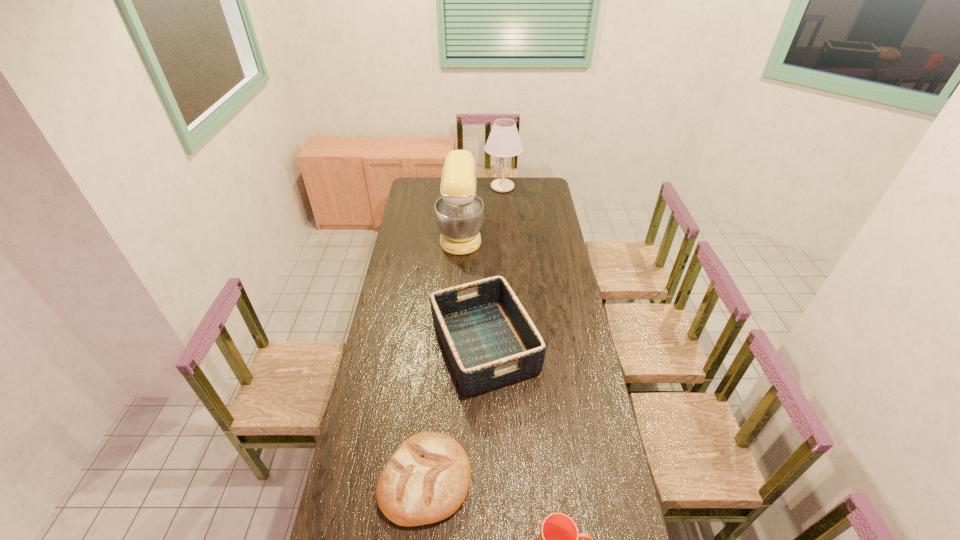
Image resolution: width=960 pixels, height=540 pixels. What are the coordinates of `object that is the third closest one to the nearest object` in the screenshot? It's located at (459, 213).

Identify the location of vacant point that satisfies the following two spatial constraints: 1. on the back side of the shortest object; 2. on the right side of the lampshade. The width and height of the screenshot is (960, 540). (452, 187).

Identify the location of free space that satisfies the following two spatial constraints: 1. on the back side of the third farthest object; 2. on the side of the mixer with the control knob. This screenshot has width=960, height=540. (483, 233).

This screenshot has width=960, height=540. Identify the location of vacant space that satisfies the following two spatial constraints: 1. on the side of the mixer with the control knob; 2. on the back side of the third tallest object. (455, 346).

The height and width of the screenshot is (540, 960). Identify the location of vacant area in the image that satisfies the following two spatial constraints: 1. on the back side of the third farthest object; 2. on the side of the fourth nearest object with the control knob. (483, 233).